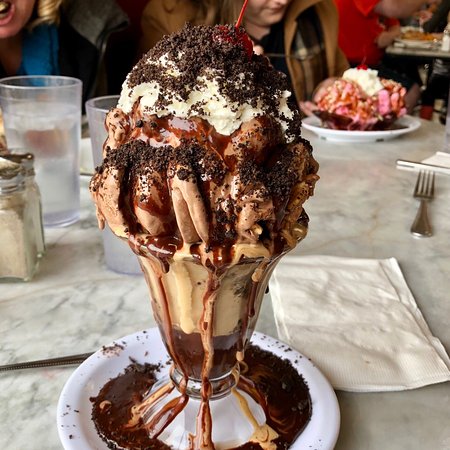
You are a GUI agent. You are given a task and a screenshot of the screen. Output one action in this format:
    pyautogui.click(x=<x>, y=<y>)
    Task: Click on the stirrer
    The image size is (450, 450).
    Given the screenshot: What is the action you would take?
    pyautogui.click(x=239, y=17)